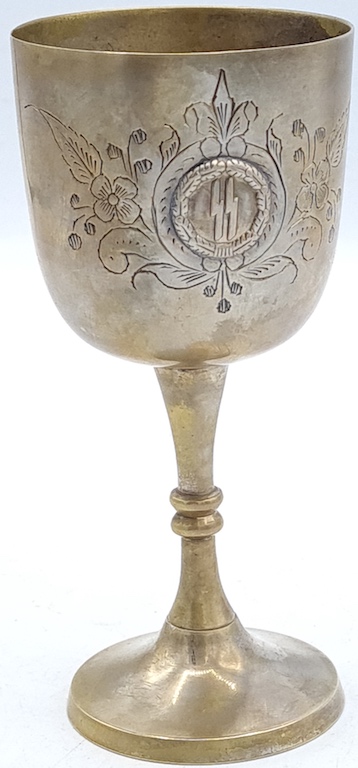
Locate an element on the screen. Image resolution: width=358 pixels, height=768 pixels. emblem design on front of goblet bowl is located at coordinates [x=127, y=197], [x=319, y=180], [x=225, y=121], [x=220, y=227].